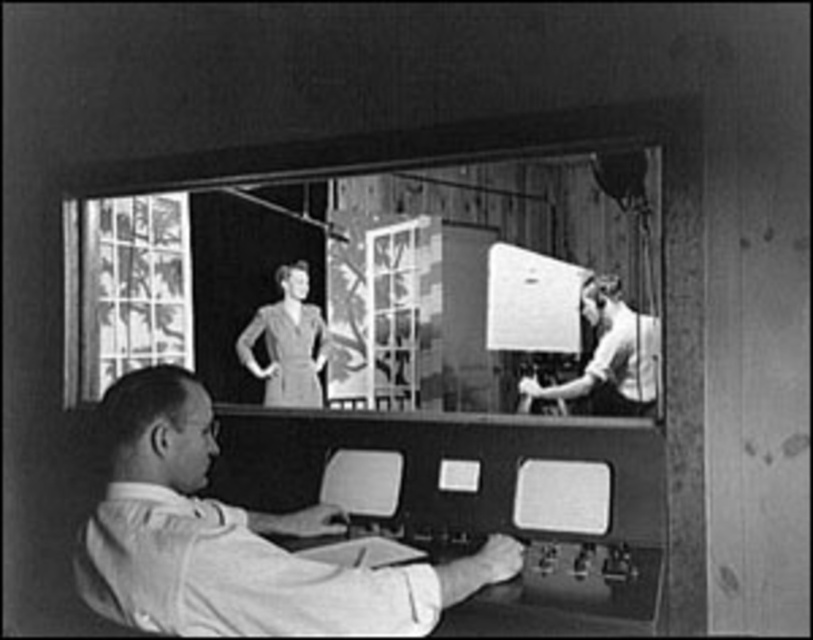
Can you confirm if smooth white shirt at center is thinner than smooth white shirt at upper right?

No.

Is smooth white shirt at center below smooth white shirt at upper right?

Yes.

Consider the image. Who is more forward, (183, 404) or (600, 412)?

Point (183, 404)

At what (x,y) coordinates should I click in order to perform the action: click on smooth white shirt at center. Please return your answer as a coordinate pair (x, y). The width and height of the screenshot is (813, 640). Looking at the image, I should click on (235, 540).

Is smooth white shirt at upper right thinner than matte gray dress at center?

Yes, smooth white shirt at upper right is thinner than matte gray dress at center.

Does point (570, 396) come farther from viewer compared to point (279, 330)?

No, it is in front of (279, 330).

Which is behind, point (598, 364) or point (316, 362)?

Positioned behind is point (316, 362).

The width and height of the screenshot is (813, 640). What are the coordinates of `smooth white shirt at upper right` in the screenshot? It's located at (607, 356).

Is point (238, 524) positioned before point (281, 294)?

Yes.

Between smooth white shirt at center and matte gray dress at center, which one has more height?

matte gray dress at center

Does point (433, 618) come behind point (277, 397)?

That is False.

The width and height of the screenshot is (813, 640). I want to click on smooth white shirt at center, so click(235, 540).